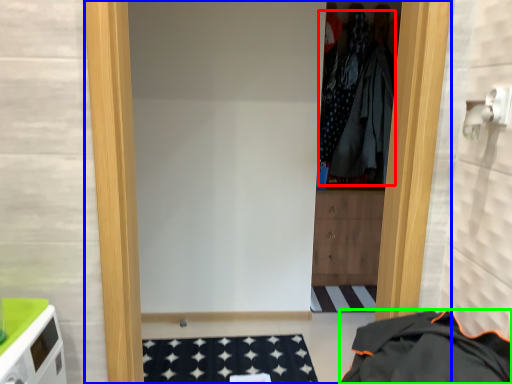
Question: Which is farther away from clothing (highlighted by a red box)? door (highlighted by a blue box) or clothing (highlighted by a green box)?

Choices:
 (A) door
 (B) clothing

Answer: (A)